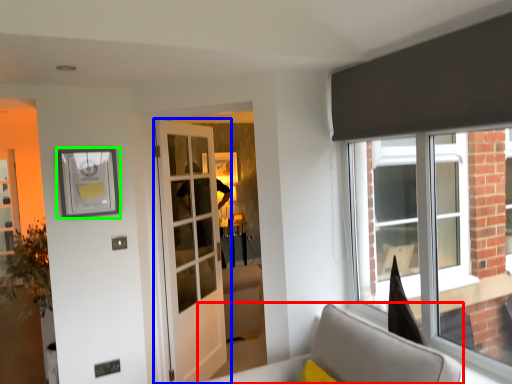
Question: Considering the real-world distances, which object is closest to furniture (highlighted by a red box)? door (highlighted by a blue box) or picture frame (highlighted by a green box).

Choices:
 (A) door
 (B) picture frame

Answer: (A)